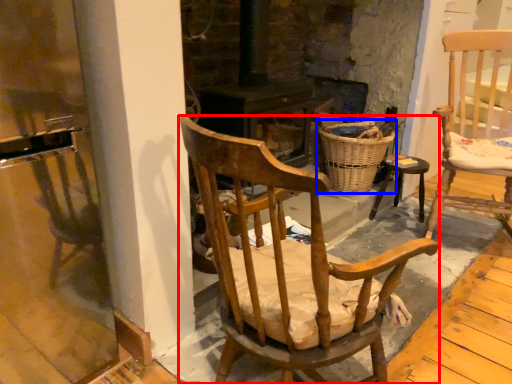
Question: Which of the following is the farthest to the observer, chair (highlighted by a red box) or basket (highlighted by a blue box)?

Choices:
 (A) chair
 (B) basket

Answer: (B)